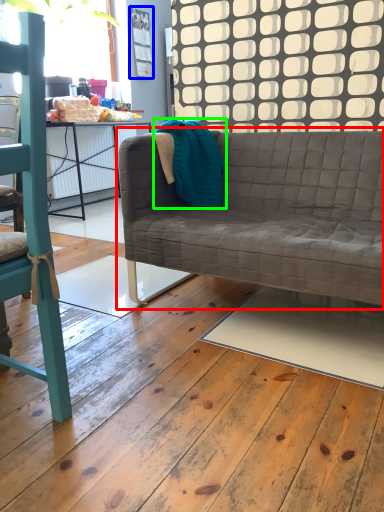
Question: Based on their relative distances, which object is nearer to studio couch (highlighted by a red box)? Choose from bulletin board (highlighted by a blue box) and material (highlighted by a green box).

Choices:
 (A) bulletin board
 (B) material

Answer: (B)